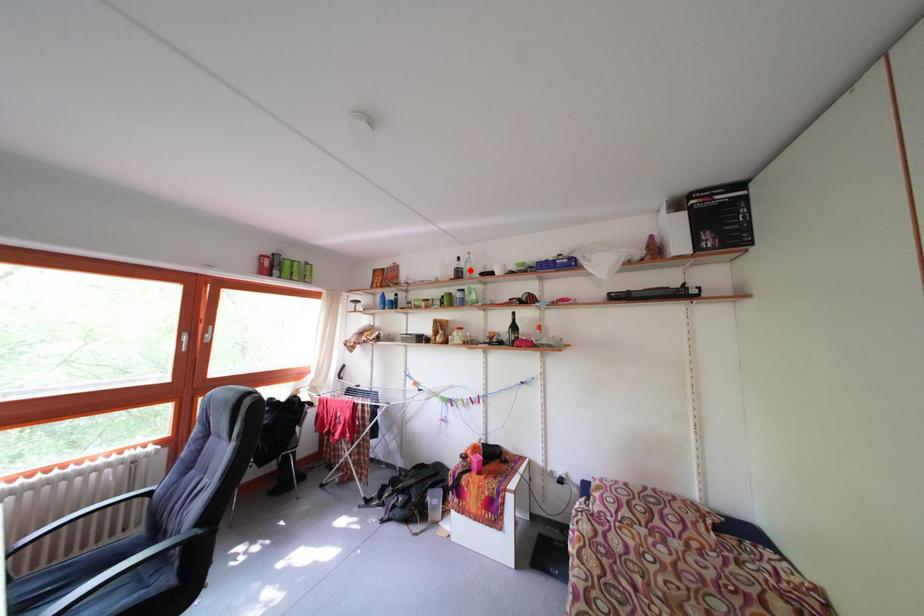
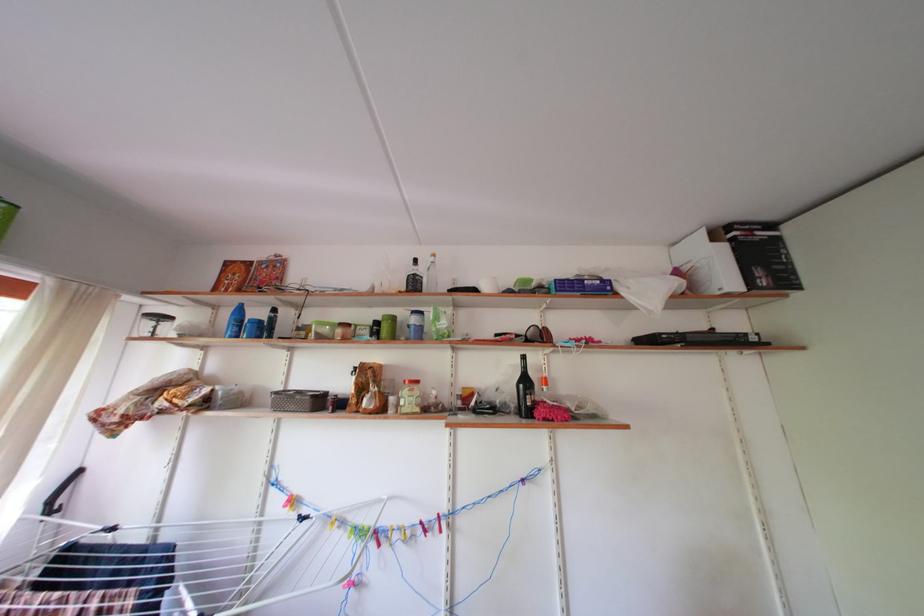
Find the pixel in the second image that matches the highlighted location in the first image.

(430, 276)